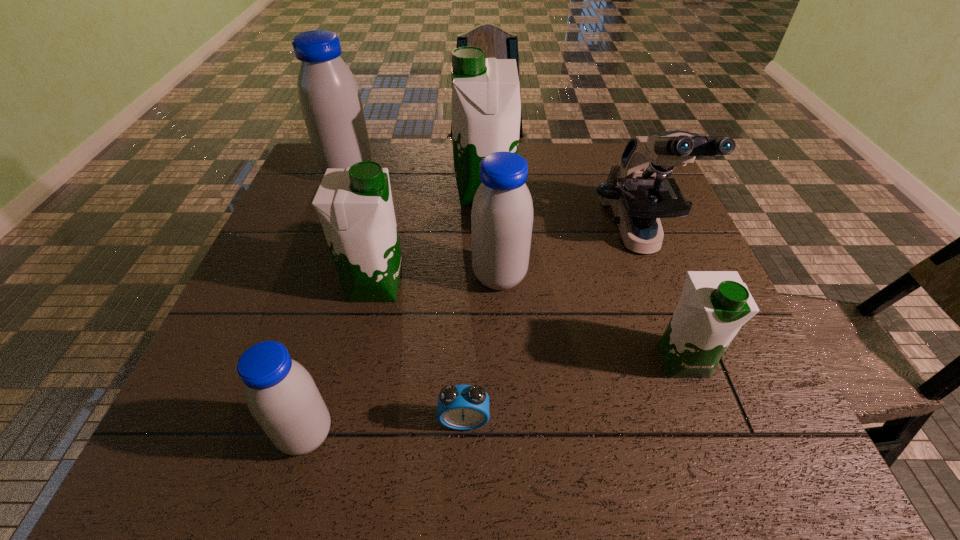
Locate an element on the screen. This screenshot has width=960, height=540. vacant space at the near edge is located at coordinates (433, 469).

The image size is (960, 540). In order to click on free space at the left edge of the desktop in this screenshot , I will do `click(322, 256)`.

Identify the location of vacant space at the right edge of the desktop. (665, 316).

Identify the location of vacant space in between the alarm clock and the biggest green soya milk. (474, 306).

At what (x,y) coordinates should I click in order to perform the action: click on free space between the rightmost green soya milk and the nearest soya milk. Please return your answer as a coordinate pair (x, y). This screenshot has width=960, height=540. Looking at the image, I should click on [494, 397].

At what (x,y) coordinates should I click in order to perform the action: click on unoccupied position between the second biggest blue soya milk and the shortest object. Please return your answer as a coordinate pair (x, y). Image resolution: width=960 pixels, height=540 pixels. Looking at the image, I should click on point(482,348).

Identify the location of vacant space that is in between the second farthest green soya milk and the nearest green soya milk. (529, 322).

Find the location of a particular element. The height and width of the screenshot is (540, 960). free space between the shortest object and the microscope is located at coordinates (551, 328).

At what (x,y) coordinates should I click in order to perform the action: click on vacant area that lies between the biggest blue soya milk and the farthest green soya milk. Please return your answer as a coordinate pair (x, y). Image resolution: width=960 pixels, height=540 pixels. Looking at the image, I should click on (417, 182).

You are a GUI agent. You are given a task and a screenshot of the screen. Output one action in this format:
    pyautogui.click(x=<x>, y=<y>)
    Task: Click on the empty space between the second smallest green soya milk and the biggest green soya milk
    The image size is (960, 540).
    Given the screenshot: What is the action you would take?
    pyautogui.click(x=430, y=239)